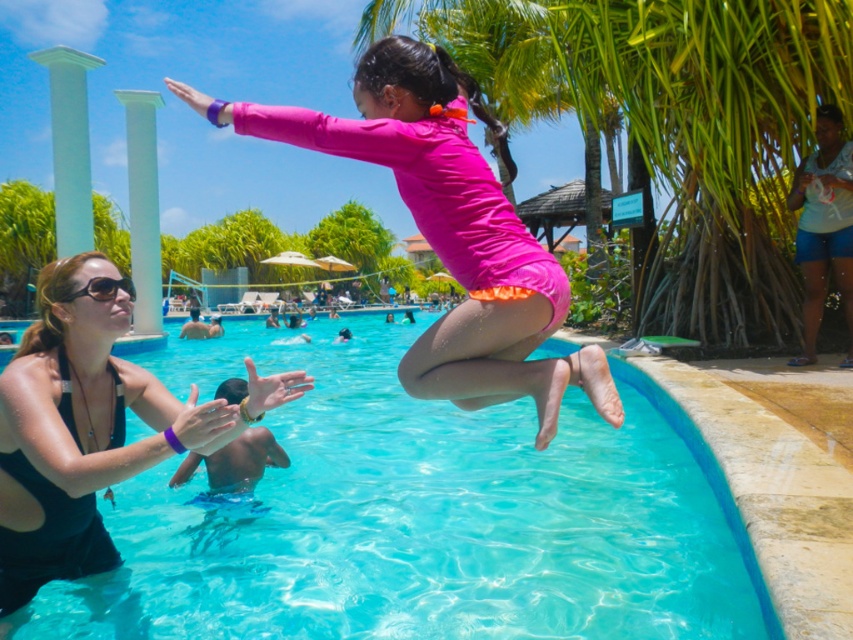
You are a photographer standing at the edge of the pool. You want to capture a photo of the young girl jumping into the pool while also including the palm tree in the background. Given that the palm tree is located at point (x=672, y=125), which is the upper center of the image, where should you position your camera to ensure both the girl and the palm tree are in frame?

To capture both the young girl jumping into the pool and the green leafy palm tree at upper center located at point (x=672, y=125), position your camera so that the girl is centered in the foreground and the palm tree is visible at the upper center of the frame. This ensures both subjects are in the shot without cropping either out.

You are a photographer standing at the edge of the pool. You want to take a photo of the pink matte swimsuit at center without the green leafy palm tree at upper center blocking the view. Is this possible?

The green leafy palm tree at upper center is further to the viewer than the pink matte swimsuit at center, so the palm tree will block the view of the swimsuit. You cannot take the photo without the palm tree blocking it.